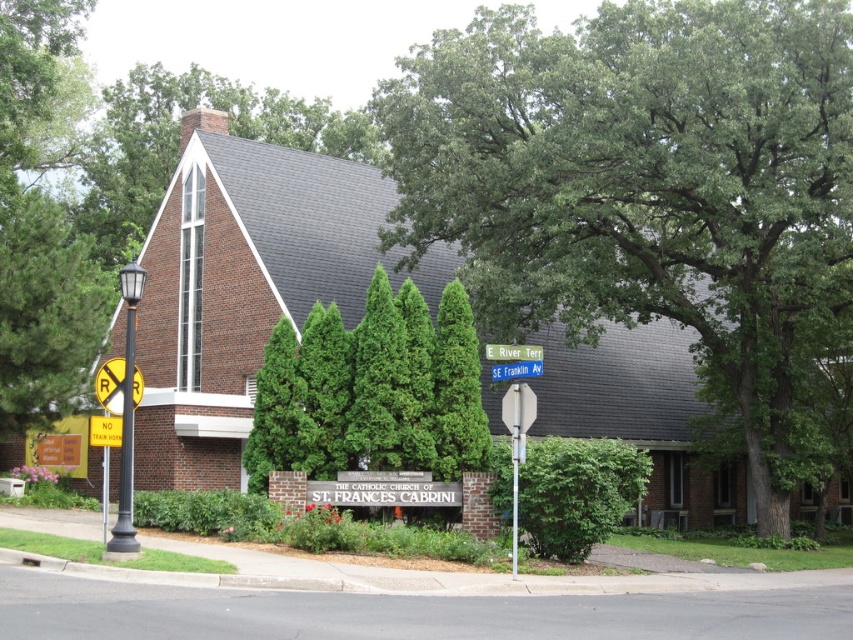
You are a visitor approaching the church and want to locate the entrance sign. Which object is taller, the green leafy tree at left or the yellow plastic sign at center?

The green leafy tree at left is taller than the yellow plastic sign at center.

You are standing at the entrance of the church and want to walk to the point marked by the coordinates point (585, 528) and point (120, 536). Which point is closer to you?

Point (120, 536) is closer to you because it is in front of point (585, 528), which is further away.